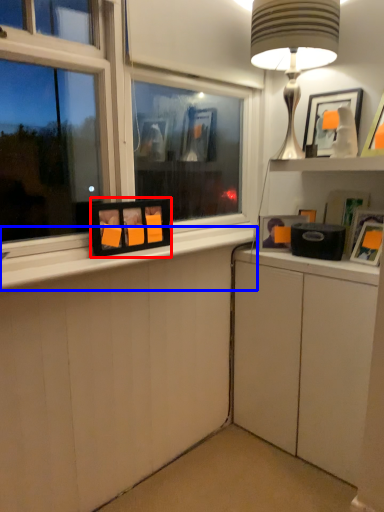
Question: Which object is further to the camera taking this photo, picture frame (highlighted by a red box) or window sill (highlighted by a blue box)?

Choices:
 (A) picture frame
 (B) window sill

Answer: (A)